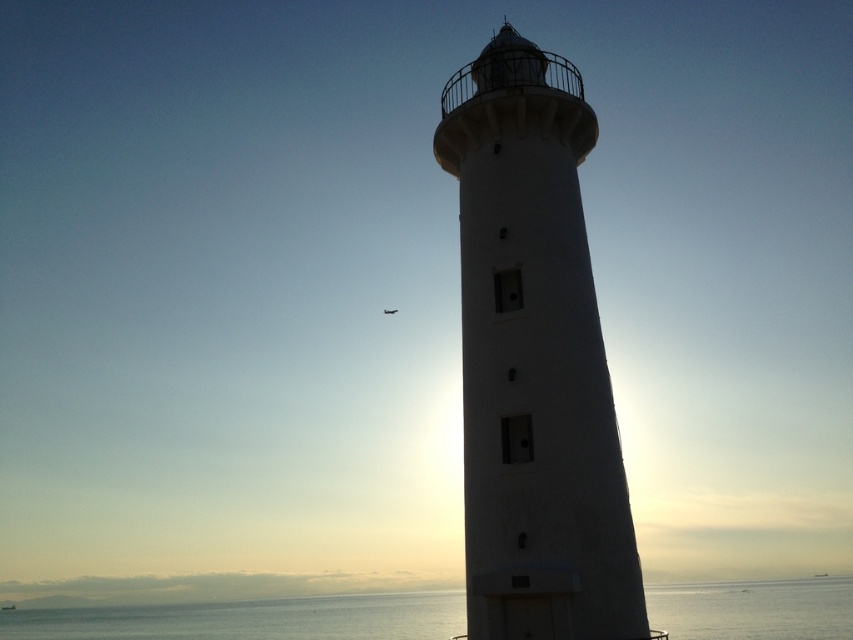
Between white smooth lighthouse at center and transparent water at lower center, which one appears on the right side from the viewer's perspective?

white smooth lighthouse at center is more to the right.

Does white smooth lighthouse at center come in front of transparent water at lower center?

Yes.

Which is behind, point (550, 381) or point (780, 612)?

The point (780, 612) is more distant.

I want to click on white smooth lighthouse at center, so click(x=534, y=360).